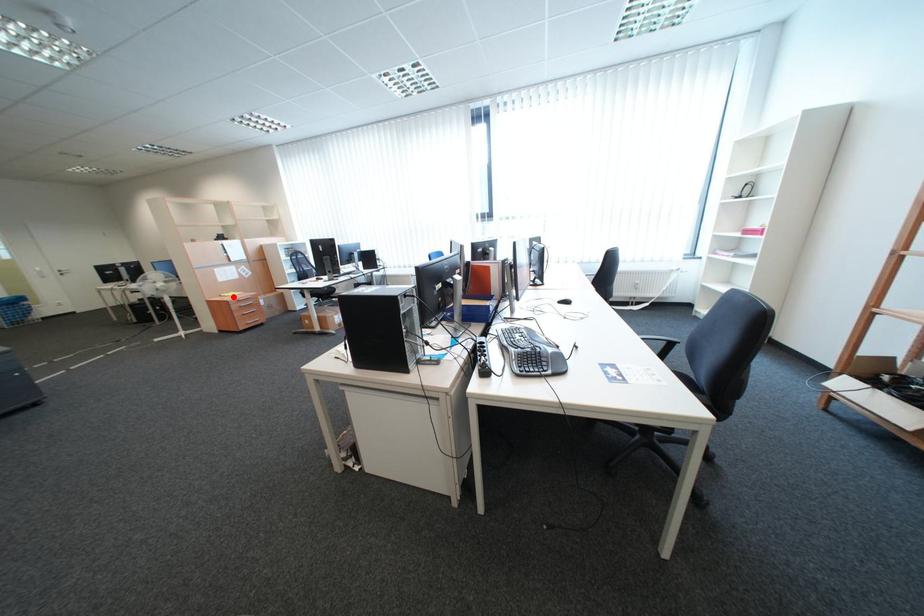
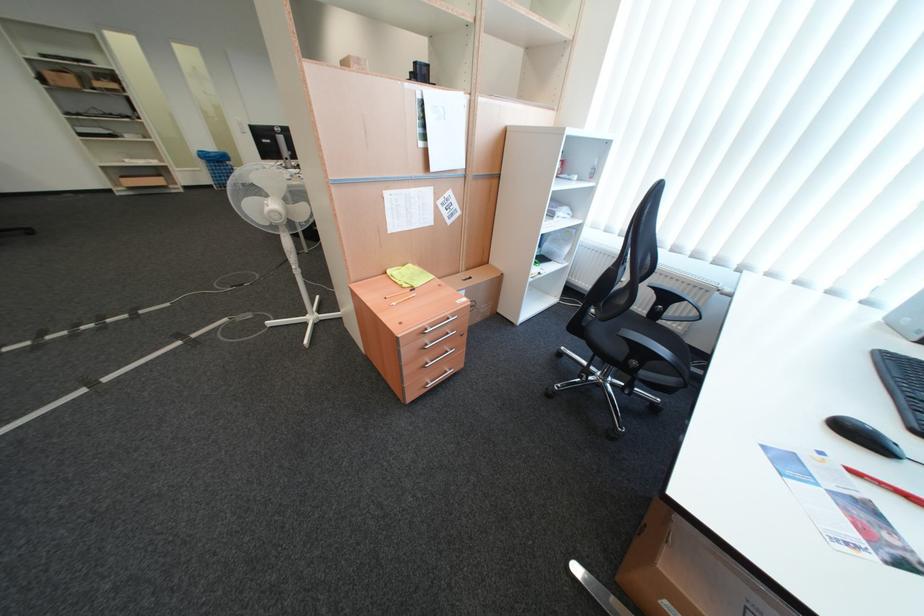
Where in the second image is the point corresponding to the highlighted location from the first image?

(397, 274)